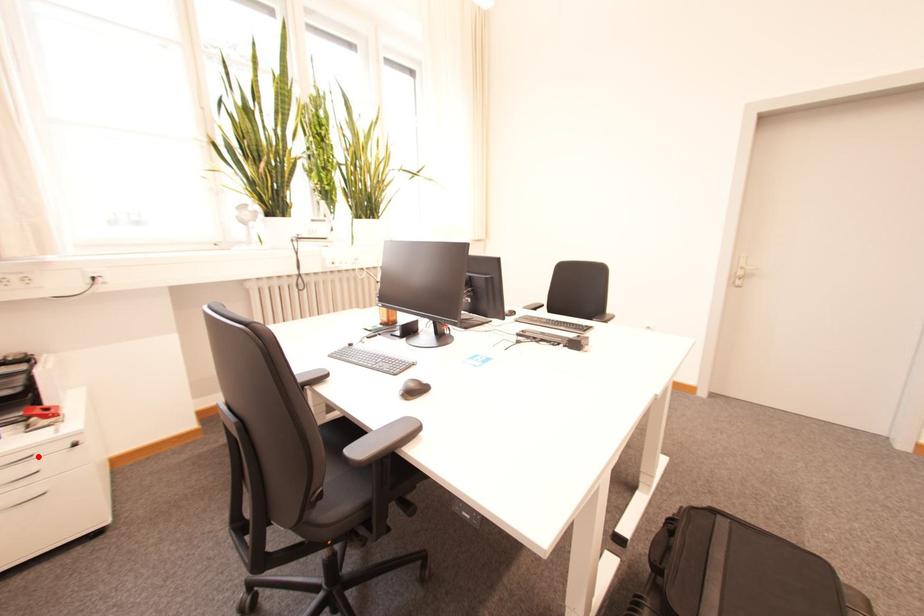
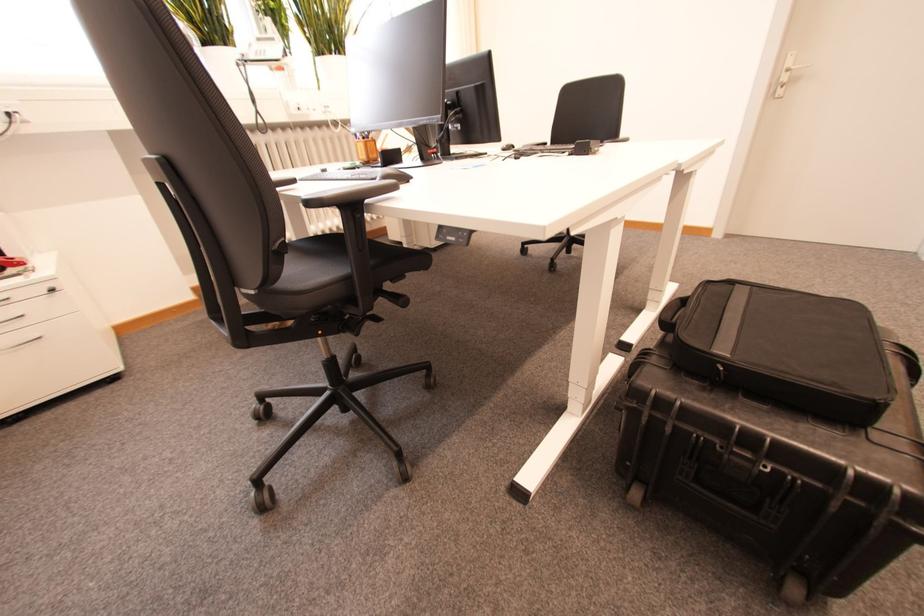
Question: I am providing you with two images of the same scene from different viewpoints. A red point is shown in image1. For the corresponding object point in image2, is it positioned nearer or farther from the camera?

Choices:
 (A) Nearer
 (B) Farther

Answer: (B)